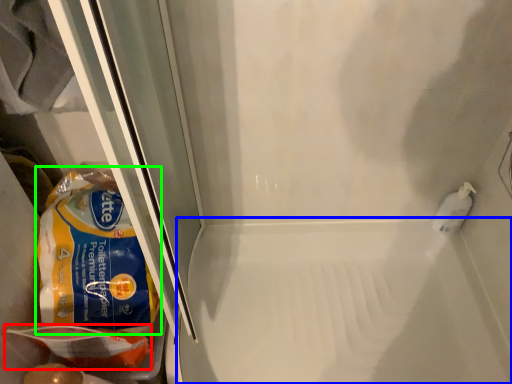
Question: Which object is the closest to the food (highlighted by a red box)? Choose among these: bath (highlighted by a blue box) or cereal (highlighted by a green box).

Choices:
 (A) bath
 (B) cereal

Answer: (B)